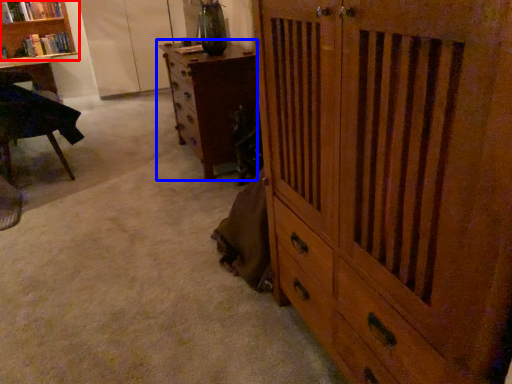
Question: Among these objects, which one is farthest to the camera, bookcase (highlighted by a red box) or chest of drawers (highlighted by a blue box)?

Choices:
 (A) bookcase
 (B) chest of drawers

Answer: (A)